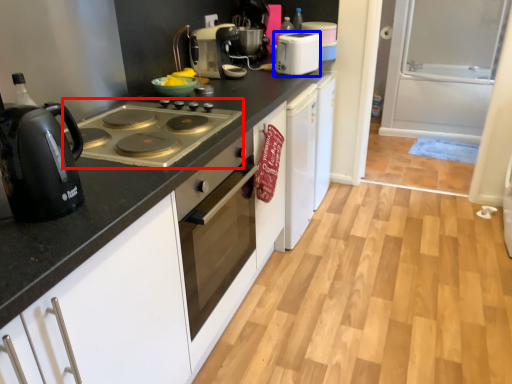
Question: Which object appears farthest to the camera in this image, gas stove (highlighted by a red box) or kitchen appliance (highlighted by a blue box)?

Choices:
 (A) gas stove
 (B) kitchen appliance

Answer: (B)